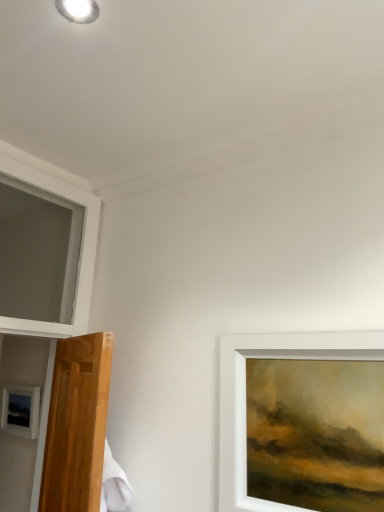
Question: From the image's perspective, would you say white glossy droplight at upper left is positioned over white frame at upper left?

Choices:
 (A) yes
 (B) no

Answer: (A)

Question: Does white glossy droplight at upper left have a smaller size compared to white frame at upper left?

Choices:
 (A) no
 (B) yes

Answer: (B)

Question: Is white glossy droplight at upper left bigger than white frame at upper left?

Choices:
 (A) no
 (B) yes

Answer: (A)

Question: Is white glossy droplight at upper left not inside white frame at upper left?

Choices:
 (A) yes
 (B) no

Answer: (A)

Question: Is the surface of white glossy droplight at upper left in direct contact with white frame at upper left?

Choices:
 (A) yes
 (B) no

Answer: (B)

Question: Is white glossy droplight at upper left to the right of white frame at upper left from the viewer's perspective?

Choices:
 (A) yes
 (B) no

Answer: (A)

Question: Would you say white frame at upper left is outside matte black picture frame at lower left?

Choices:
 (A) no
 (B) yes

Answer: (B)

Question: From the image's perspective, would you say white frame at upper left is shown under matte black picture frame at lower left?

Choices:
 (A) no
 (B) yes

Answer: (A)

Question: Is white frame at upper left smaller than matte black picture frame at lower left?

Choices:
 (A) no
 (B) yes

Answer: (A)

Question: Is matte black picture frame at lower left inside white frame at upper left?

Choices:
 (A) no
 (B) yes

Answer: (A)

Question: Is white frame at upper left positioned before matte black picture frame at lower left?

Choices:
 (A) yes
 (B) no

Answer: (A)

Question: Is white frame at upper left wider than matte black picture frame at lower left?

Choices:
 (A) no
 (B) yes

Answer: (B)

Question: Can you confirm if white frame at upper left is wider than white glossy droplight at upper left?

Choices:
 (A) yes
 (B) no

Answer: (A)